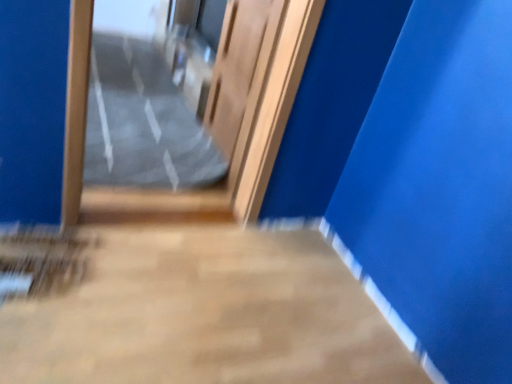
Question: In terms of height, does wooden door at center look taller or shorter compared to clear plastic bag at center?

Choices:
 (A) short
 (B) tall

Answer: (B)

Question: Looking at their shapes, would you say wooden door at center is wider or thinner than clear plastic bag at center?

Choices:
 (A) wide
 (B) thin

Answer: (B)

Question: Which of these objects is positioned farthest from the smooth concrete floor at center?

Choices:
 (A) wooden door at center
 (B) clear plastic bag at center
 (C) wooden door at center

Answer: (B)

Question: Estimate the real-world distances between objects in this image. Which object is farther from the smooth concrete floor at center?

Choices:
 (A) clear plastic bag at center
 (B) wooden door at center
 (C) wooden door at center

Answer: (A)